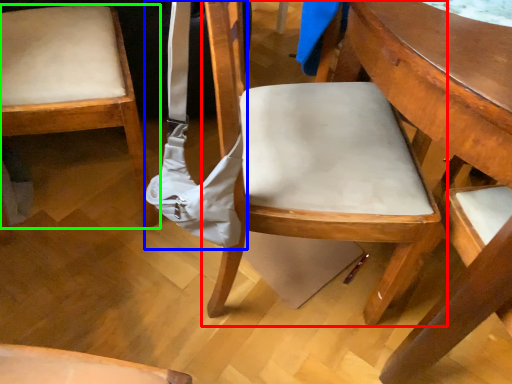
Question: Estimate the real-world distances between objects in this image. Which object is farther from chair (highlighted by a red box), shoulder bag (highlighted by a blue box) or chair (highlighted by a green box)?

Choices:
 (A) shoulder bag
 (B) chair

Answer: (B)